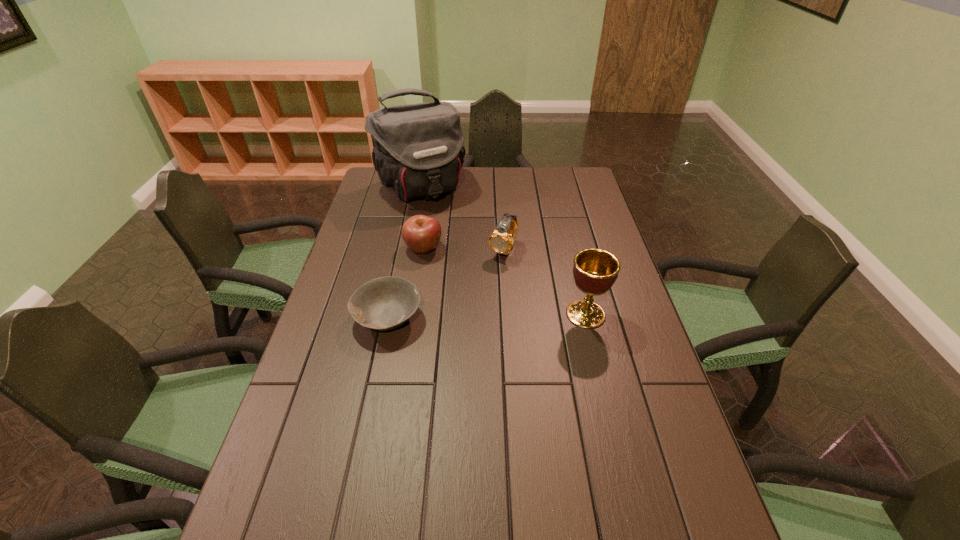
At what (x,y) coordinates should I click in order to perform the action: click on free space that satisfies the following two spatial constraints: 1. on the back side of the apple; 2. on the left side of the shortest object. Please return your answer as a coordinate pair (x, y). Looking at the image, I should click on (402, 248).

This screenshot has height=540, width=960. I want to click on vacant space that satisfies the following two spatial constraints: 1. on the front side of the shoulder bag; 2. on the right side of the fourth tallest object, so click(x=409, y=248).